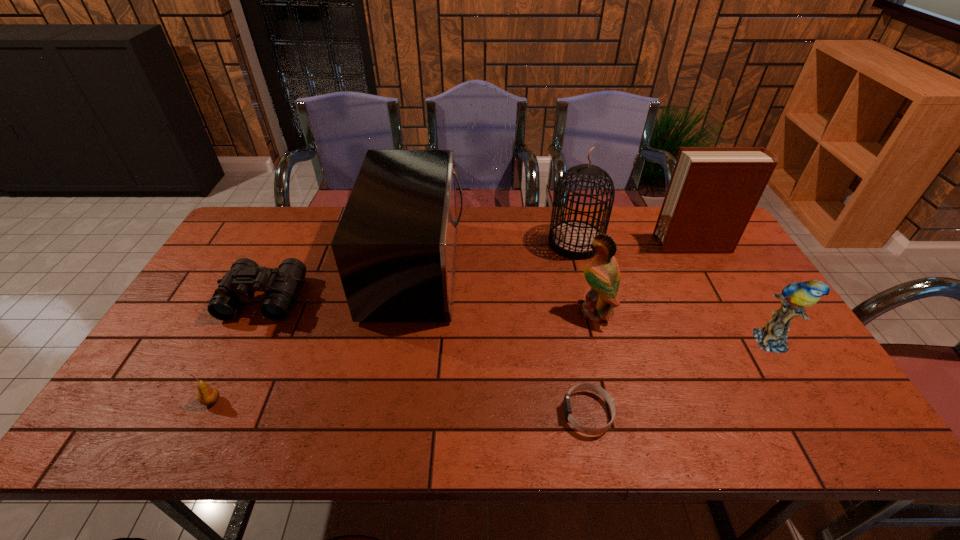
Identify the location of free space between the pear and the left parrot. This screenshot has width=960, height=540. (403, 356).

Identify the location of free space between the pear and the hardback book. (453, 323).

At what (x,y) coordinates should I click in order to perform the action: click on free space that is in between the hardback book and the left parrot. Please return your answer as a coordinate pair (x, y). The height and width of the screenshot is (540, 960). Looking at the image, I should click on (644, 278).

Locate an element on the screen. This screenshot has width=960, height=540. empty space between the right parrot and the second shortest object is located at coordinates (492, 371).

Locate which object ranks third in proximity to the wristband. Please provide its 2D coordinates. Your answer should be formatted as a tuple, i.e. [(x, y)], where the tuple contains the x and y coordinates of a point satisfying the conditions above.

[(772, 337)]

Choose which object is the second nearest neighbor to the microwave oven. Please provide its 2D coordinates. Your answer should be formatted as a tuple, i.e. [(x, y)], where the tuple contains the x and y coordinates of a point satisfying the conditions above.

[(572, 238)]